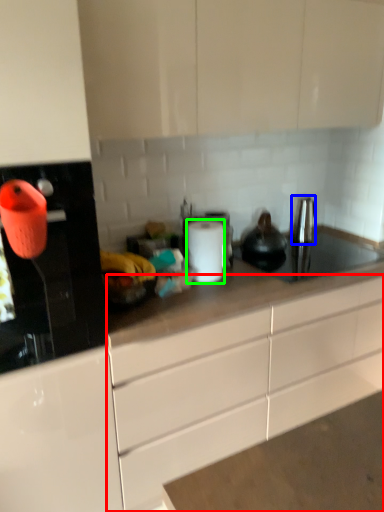
Question: Which object is positioned farthest from cabinetry (highlighted by a red box)? Select from faucet (highlighted by a blue box) and paper towel (highlighted by a green box).

Choices:
 (A) faucet
 (B) paper towel

Answer: (A)